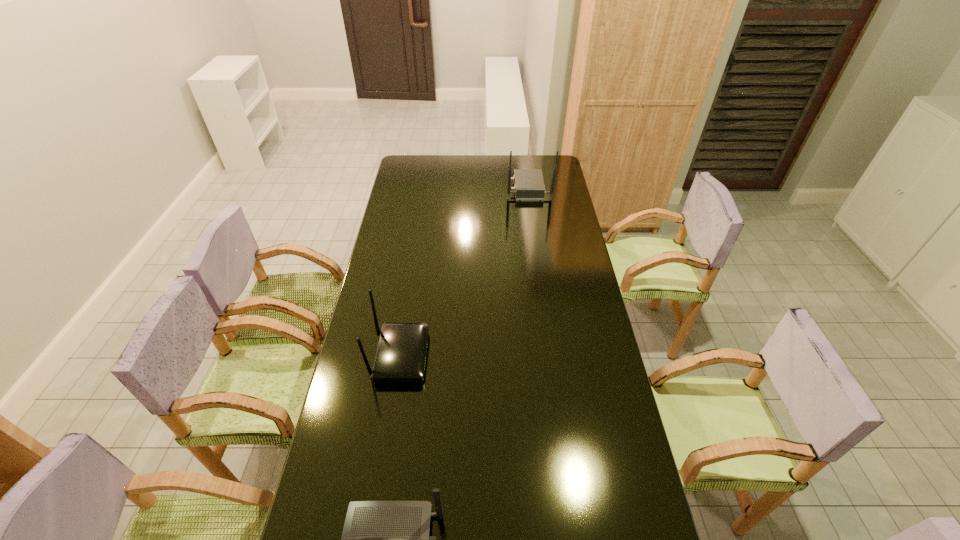
Locate an element on the screen. The image size is (960, 540). the farthest router is located at coordinates (529, 186).

This screenshot has width=960, height=540. I want to click on the farthest object, so click(529, 186).

Where is `the second shortest router`? Image resolution: width=960 pixels, height=540 pixels. the second shortest router is located at coordinates (401, 353).

Locate an element on the screen. the second nearest router is located at coordinates (401, 353).

Find the location of a particular element. Image resolution: width=960 pixels, height=540 pixels. vacant space positioned 0.180m on the back of the farthest router to connect cables is located at coordinates (470, 188).

You are a GUI agent. You are given a task and a screenshot of the screen. Output one action in this format:
    pyautogui.click(x=<x>, y=<y>)
    Task: Click on the vacant position located on the back of the farthest router to connect cables
    This screenshot has height=540, width=960.
    Given the screenshot: What is the action you would take?
    pyautogui.click(x=467, y=188)

Locate an element on the screen. The height and width of the screenshot is (540, 960). vacant region located on the back of the farthest router to connect cables is located at coordinates (467, 188).

Find the location of a particular element. vacant space located 0.400m on the front-facing side of the second farthest object is located at coordinates (545, 356).

Locate an element on the screen. The width and height of the screenshot is (960, 540). object that is positioned at the far edge is located at coordinates (529, 186).

This screenshot has width=960, height=540. What are the coordinates of `object that is at the left edge` in the screenshot? It's located at (401, 353).